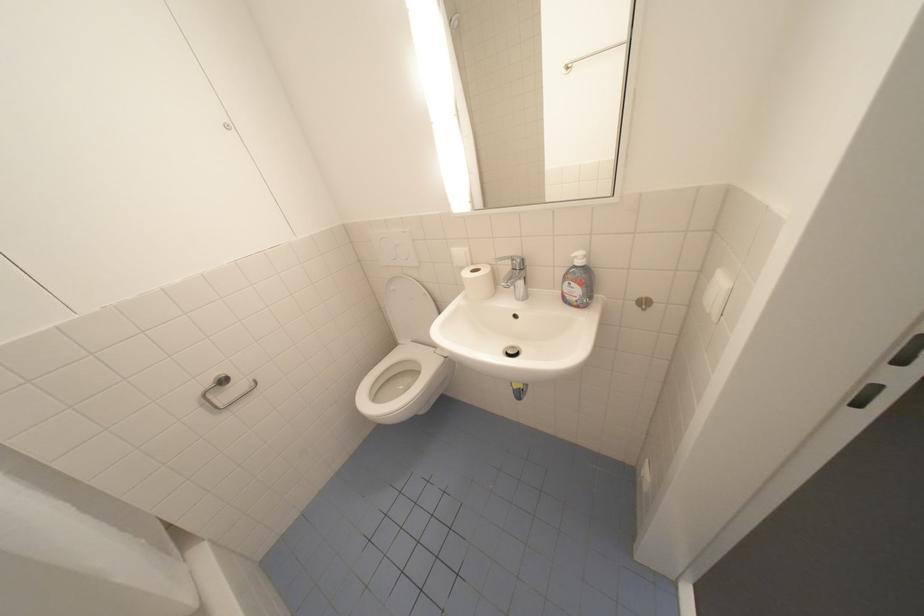
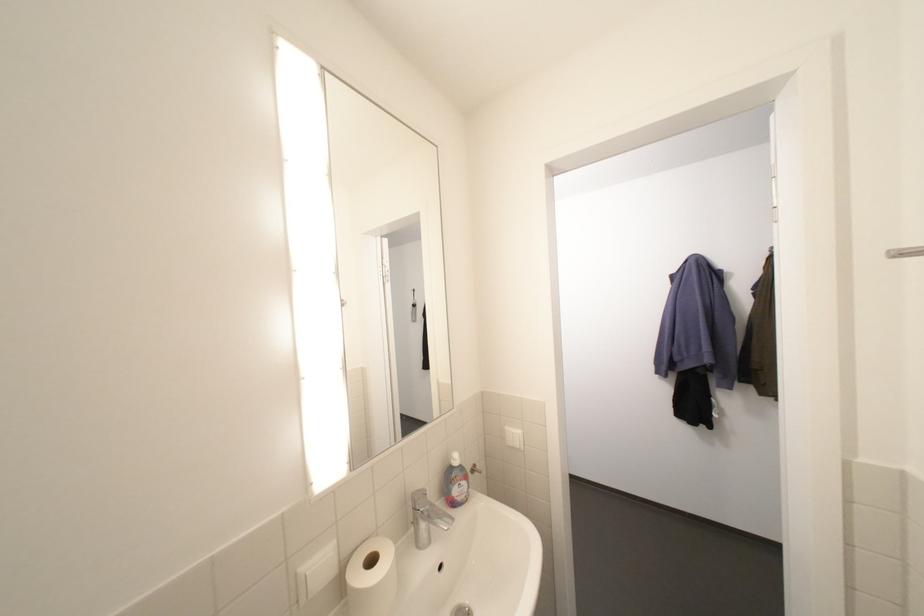
Where in the second image is the point corresponding to point 574,296 from the first image?

(465, 499)